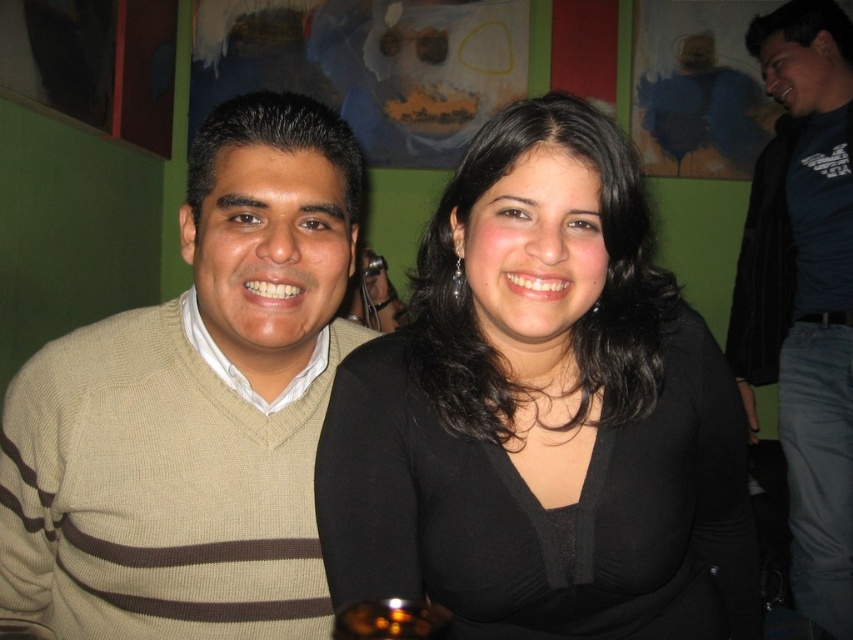
Question: Is black matte shirt at center further to camera compared to dark blue shirt at right?

Choices:
 (A) yes
 (B) no

Answer: (B)

Question: Can you confirm if beige striped sweater at left is smaller than dark blue shirt at right?

Choices:
 (A) yes
 (B) no

Answer: (A)

Question: Which object is positioned closest to the black matte shirt at center?

Choices:
 (A) dark blue shirt at right
 (B) beige striped sweater at left

Answer: (B)

Question: Which point appears closest to the camera in this image?

Choices:
 (A) (651, 525)
 (B) (93, 488)
 (C) (805, 88)

Answer: (A)

Question: Which point is farther to the camera?

Choices:
 (A) click(846, 392)
 (B) click(749, 577)

Answer: (A)

Question: Is beige striped sweater at left to the right of dark blue shirt at right from the viewer's perspective?

Choices:
 (A) yes
 (B) no

Answer: (B)